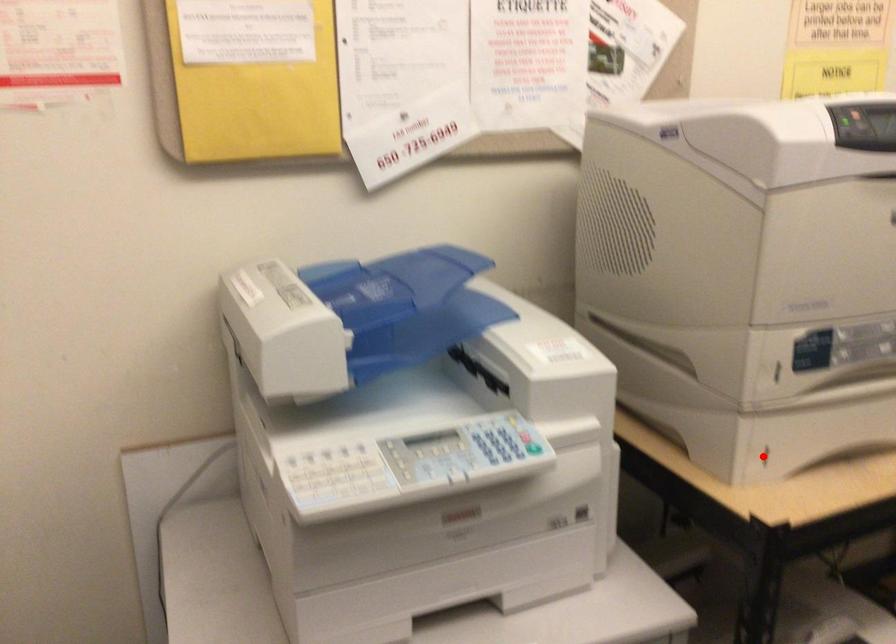
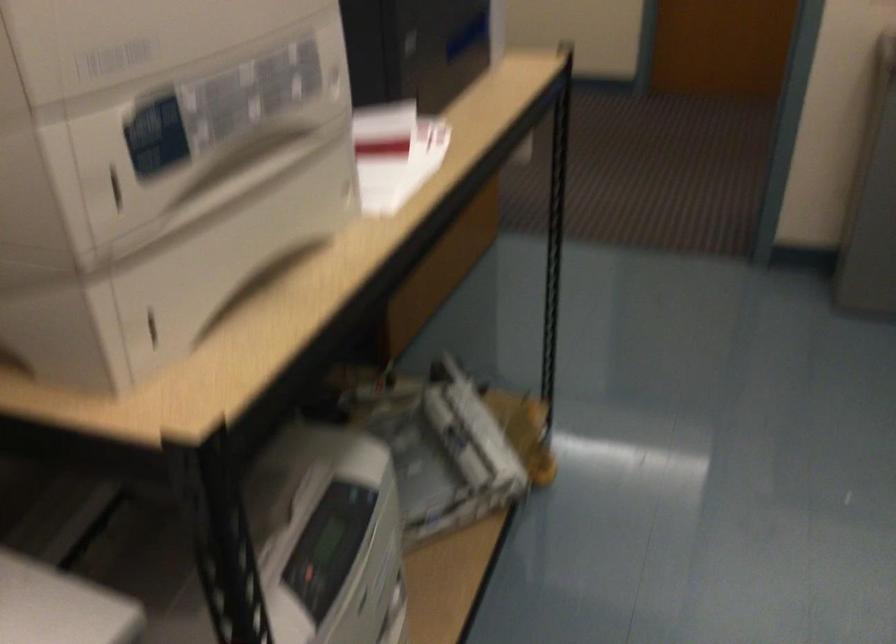
In the second image, find the point that corresponds to the highlighted location in the first image.

(151, 327)